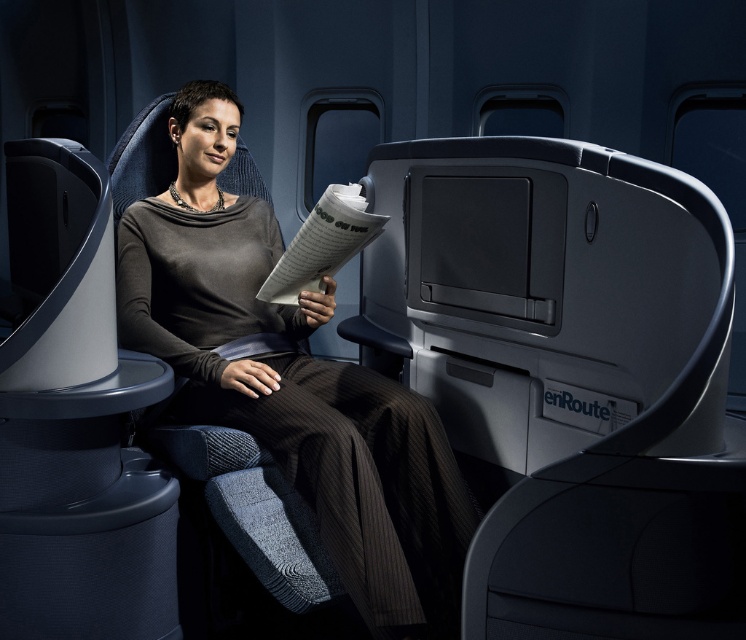
Based on the photo, you are a flight attendant on an airplane. You need to hand a blanket to the passenger seated at point [292,381]. Which object at that point should you place the blanket on?

The matte gray sweater at center is located at point [292,381]. You should place the blanket on the matte gray sweater at center.

You are sitting in the airplane cabin and want to reach a button located at point (292, 433). There is an armrest at point (366, 225). Can you reach the button without moving the armrest?

Point (292, 433) is in front of point (366, 225), so yes, you can reach the button at point (292, 433) without moving the armrest at point (366, 225) since it is closer to you.

You are a flight attendant checking the seating area. You see the matte gray sweater at center and the white paper at center. Which item is closer to the floor?

The matte gray sweater at center is closer to the floor because it is positioned under the white paper at center.